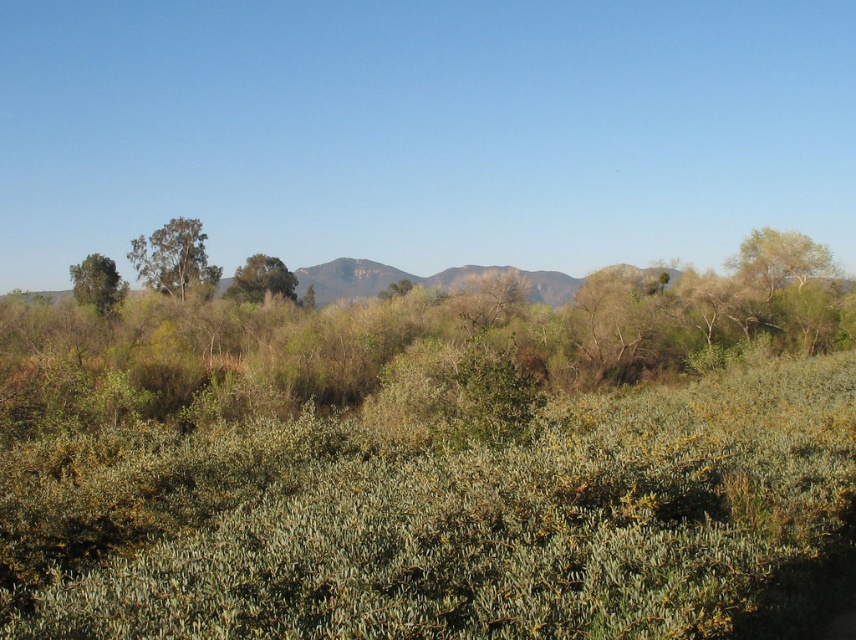
Question: Can you confirm if green leafy tree at center is positioned to the right of green leafy tree at left?

Choices:
 (A) yes
 (B) no

Answer: (A)

Question: Where is green leafy tree at upper right located in relation to green leafy tree at left in the image?

Choices:
 (A) right
 (B) left

Answer: (A)

Question: Which object is positioned farthest from the green leafy tree at left?

Choices:
 (A) green leafy tree at center
 (B) green leafy tree at upper right

Answer: (B)

Question: Which point is closer to the camera?

Choices:
 (A) green leafy tree at upper right
 (B) green leafy tree at upper left
 (C) green leafy tree at left
 (D) green leafy tree at center

Answer: (C)

Question: In this image, where is green leafy tree at upper left located relative to green leafy tree at upper right?

Choices:
 (A) left
 (B) right

Answer: (A)

Question: Which of the following is the closest to the observer?

Choices:
 (A) (257, 292)
 (B) (152, 243)
 (C) (788, 269)

Answer: (C)